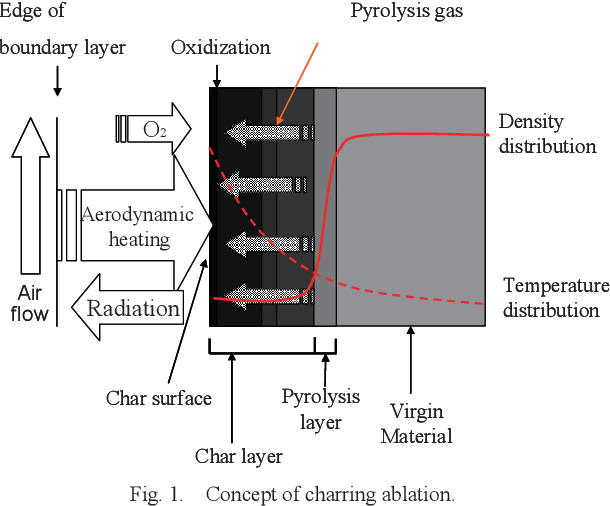
What are the coordinates of `large bracket` in the screenshot? It's located at (207, 346), (315, 344).